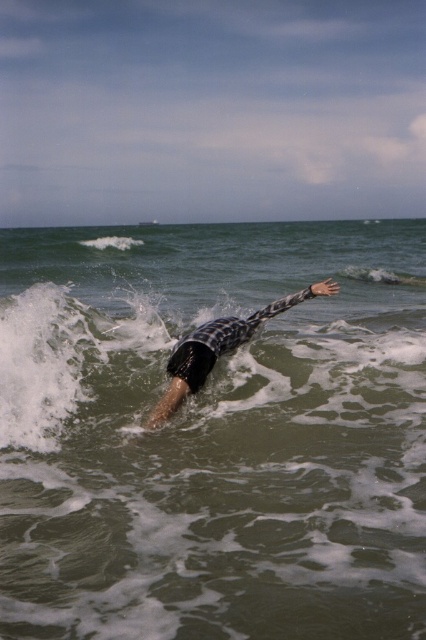
Question: Can you confirm if greenish water at center is positioned to the left of black checkered wetsuit at center?

Choices:
 (A) no
 (B) yes

Answer: (B)

Question: Is greenish water at center above black checkered wetsuit at center?

Choices:
 (A) yes
 (B) no

Answer: (A)

Question: Which point is closer to the camera?

Choices:
 (A) (236, 324)
 (B) (281, 387)

Answer: (B)

Question: Is greenish water at center further to the viewer compared to black checkered wetsuit at center?

Choices:
 (A) yes
 (B) no

Answer: (B)